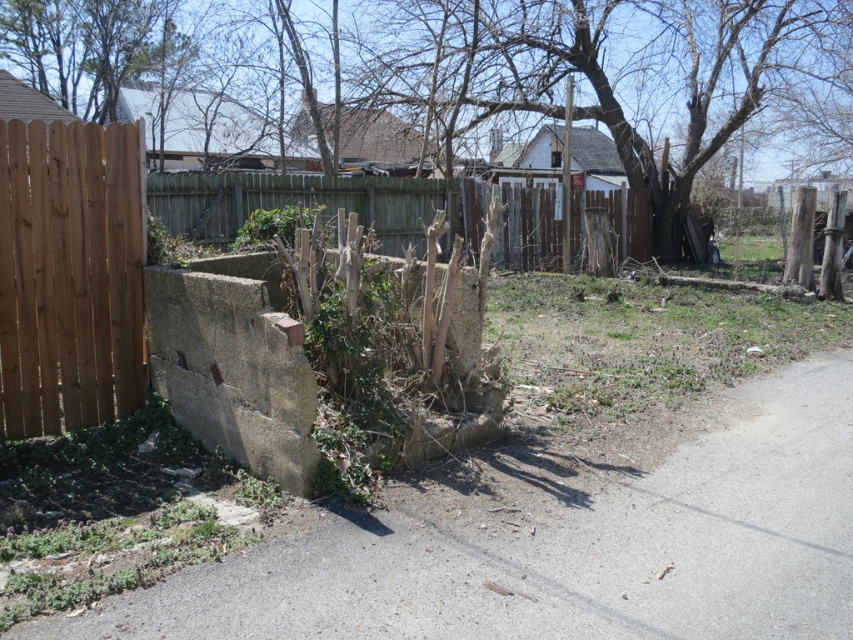
Is point (717, 99) closer to viewer compared to point (514, 241)?

No.

The image size is (853, 640). I want to click on brown wood tree at center, so click(618, 72).

You are a GUI agent. You are given a task and a screenshot of the screen. Output one action in this format:
    pyautogui.click(x=<x>, y=<y>)
    Task: Click on the brown wood tree at center
    The image size is (853, 640).
    Given the screenshot: What is the action you would take?
    pyautogui.click(x=618, y=72)

Which is more to the left, brown wooden fence at left or brown wooden fence at center?

Positioned to the left is brown wooden fence at left.

Is point (93, 278) positioned in front of point (554, 209)?

That is True.

This screenshot has width=853, height=640. Find the location of `brown wooden fence at left`. brown wooden fence at left is located at coordinates (68, 275).

Which is more to the right, brown wood tree at center or brown wooden fence at left?

brown wood tree at center

Consider the image. Does brown wood tree at center appear under brown wooden fence at left?

Actually, brown wood tree at center is above brown wooden fence at left.

Image resolution: width=853 pixels, height=640 pixels. In order to click on brown wood tree at center in this screenshot , I will do `click(618, 72)`.